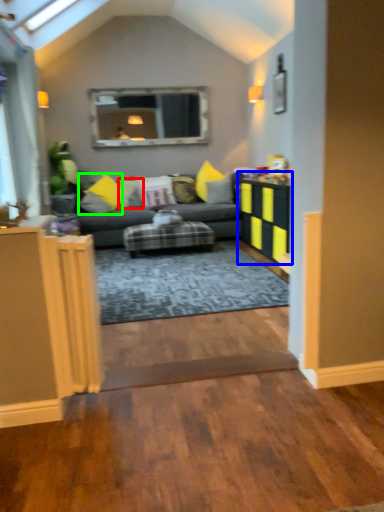
Question: Which object is positioned farthest from pillow (highlighted by a red box)? Select from table (highlighted by a blue box) and pillow (highlighted by a green box).

Choices:
 (A) table
 (B) pillow

Answer: (A)